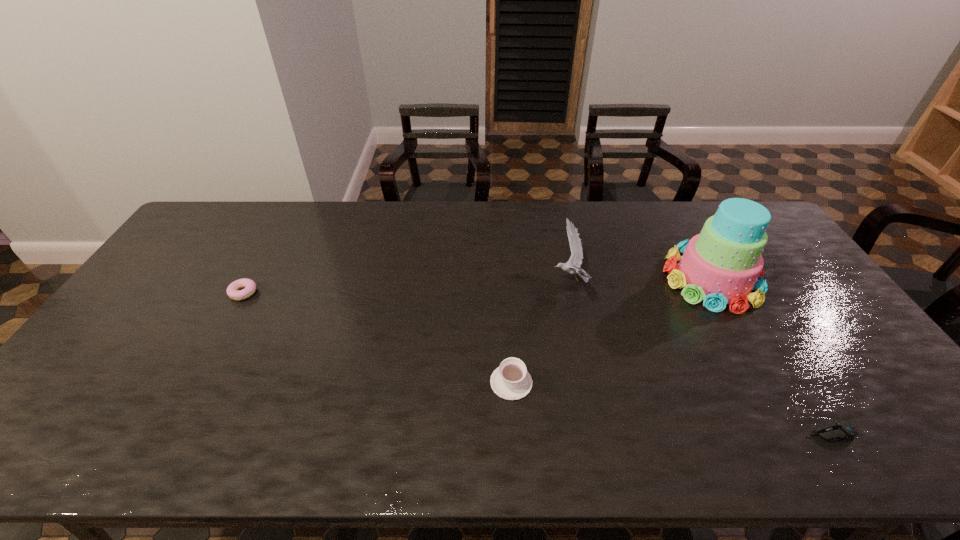
Where is `free space located at the tip of the beak of the gull`? free space located at the tip of the beak of the gull is located at coordinates pyautogui.click(x=450, y=280).

At what (x,y) coordinates should I click in order to perform the action: click on vacant space located 0.050m on the handle side of the second object from left to right. Please return your answer as a coordinate pair (x, y). Looking at the image, I should click on (509, 349).

What are the coordinates of `free space located 0.310m on the handle side of the second object from left to right` in the screenshot? It's located at (505, 282).

Where is `free space located 0.210m on the handle side of the second object from left to right`? free space located 0.210m on the handle side of the second object from left to right is located at coordinates (507, 306).

In order to click on vacant space located on the left of the doughnut in this screenshot , I will do `click(191, 293)`.

The width and height of the screenshot is (960, 540). Identify the location of vacant space positioned on the left of the computer mouse. (767, 433).

Identify the location of object situated at the near edge. This screenshot has width=960, height=540. (836, 430).

You are a GUI agent. You are given a task and a screenshot of the screen. Output one action in this format:
    pyautogui.click(x=<x>, y=<y>)
    Task: Click on the object that is positioned at the right edge
    The width and height of the screenshot is (960, 540).
    Given the screenshot: What is the action you would take?
    [721, 265]

In the image, there is a desktop. Identify the location of vacant space at the far edge. (482, 225).

This screenshot has width=960, height=540. In the image, there is a desktop. Find the location of `vacant space at the near edge`. vacant space at the near edge is located at coordinates (183, 426).